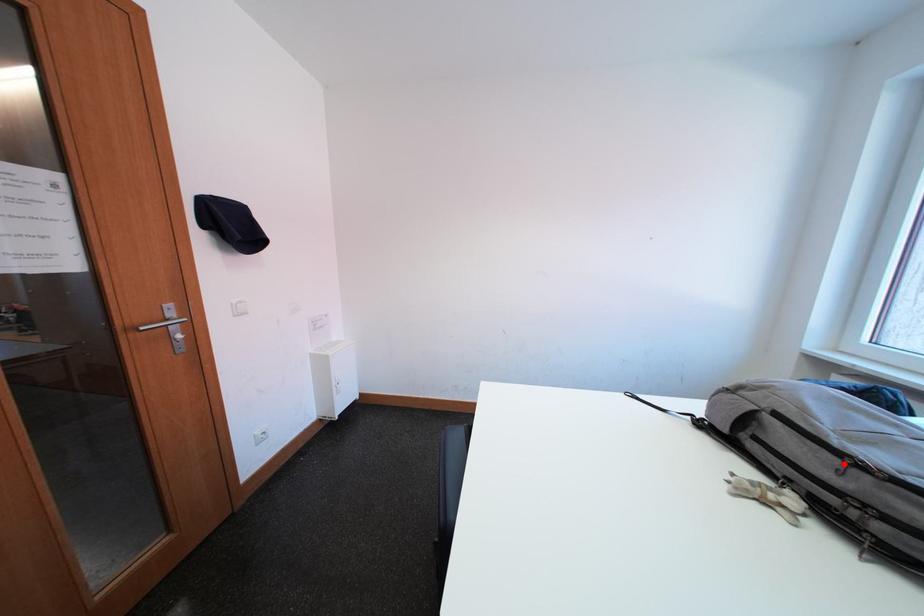
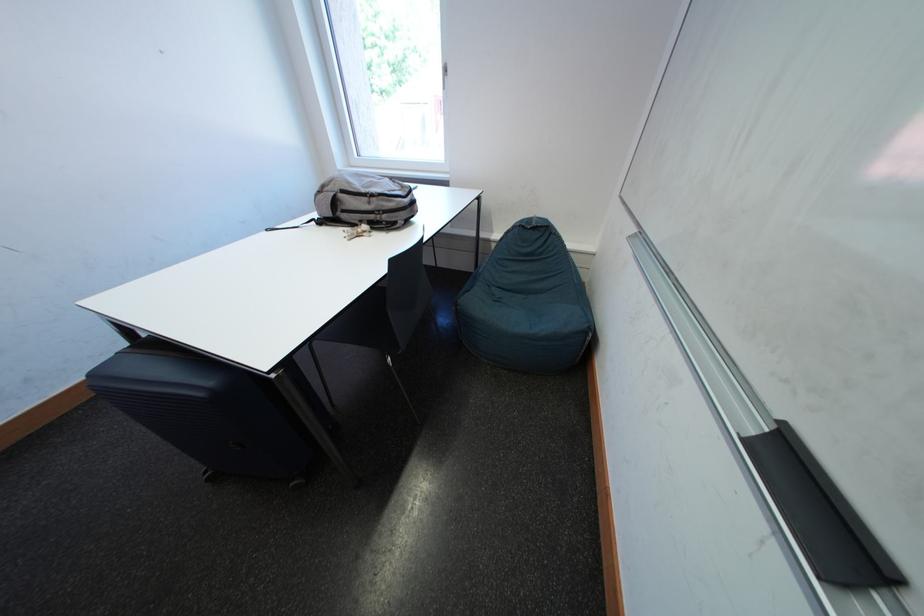
Question: I am providing you with two images of the same scene from different viewpoints. Image1 has a red point marked. In image2, the corresponding 3D location appears at what relative position? Reply with the corresponding letter.

Choices:
 (A) Closer
 (B) Farther

Answer: (A)